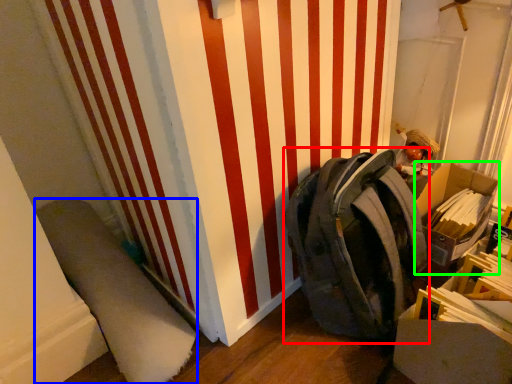
Question: Which object is the farthest from backpack (highlighted by a red box)? Choose among these: wide (highlighted by a blue box) or cardboard box (highlighted by a green box).

Choices:
 (A) wide
 (B) cardboard box

Answer: (A)